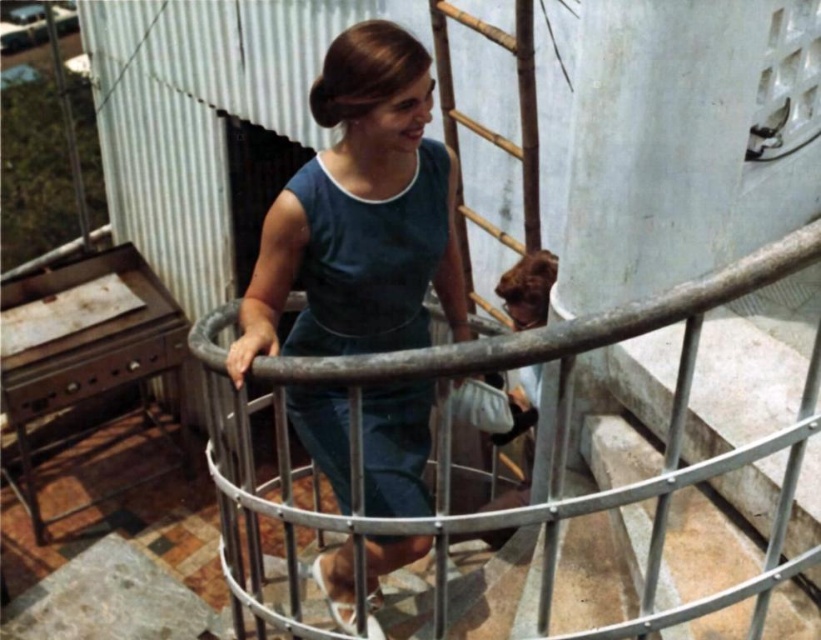
Is point (211, 326) more distant than point (548, 280)?

No, it is not.

Between metallic silver railing at center and bamboo ladder at center, which one appears on the right side from the viewer's perspective?

Positioned to the right is bamboo ladder at center.

Is point (209, 326) behind point (514, 289)?

No.

At what (x,y) coordinates should I click in order to perform the action: click on metallic silver railing at center. Please return your answer as a coordinate pair (x, y). The height and width of the screenshot is (640, 821). Looking at the image, I should click on (553, 440).

Based on the photo, is blue fabric dress at center thinner than bamboo ladder at center?

No.

Which is behind, point (379, 42) or point (502, 506)?

Point (502, 506)

You are a GUI agent. You are given a task and a screenshot of the screen. Output one action in this format:
    pyautogui.click(x=<x>, y=<y>)
    Task: Click on the blue fabric dress at center
    The height and width of the screenshot is (640, 821).
    Given the screenshot: What is the action you would take?
    pyautogui.click(x=360, y=214)

Which is below, blue fabric dress at center or metallic silver railing at center?

Positioned lower is metallic silver railing at center.

Can you confirm if blue fabric dress at center is thinner than metallic silver railing at center?

Yes, blue fabric dress at center is thinner than metallic silver railing at center.

Identify the location of blue fabric dress at center. (360, 214).